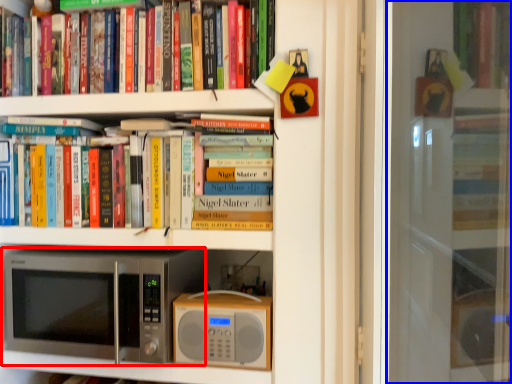
Question: Which object is closer to the camera taking this photo, microwave oven (highlighted by a red box) or screen door (highlighted by a blue box)?

Choices:
 (A) microwave oven
 (B) screen door

Answer: (B)